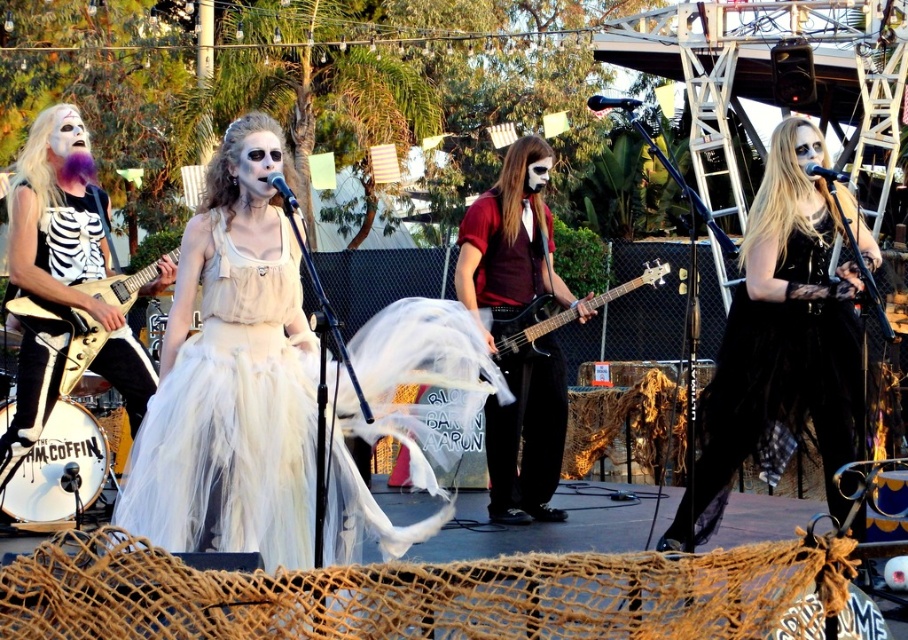
You are a photographer at the music festival. You want to capture a closeup shot of the singer in the white tulle dress at center. The stage is divided into sections with coordinates. The center of the stage is at point 0.5, 0.5. Your camera is currently focused on point (x=232, y=419). Is your camera already focused on the singer?

The white tulle dress at center is located at point (x=232, y=419), so yes, the camera is already focused on the singer in the white tulle dress at center.

You are a photographer at the concert. You want to take a photo that includes both the matte white dress at center and the black velvet dress at right. Which dress will appear larger in the photo?

The matte white dress at center will appear larger in the photo because it is closer to the viewer than the black velvet dress at right.

You are standing in the audience watching the performance. You notice two points marked on the stage. The first point is at coordinates point (215, 392) and the second is at point (566, 310). Which point is closer to you?

Point (215, 392) is closer to the viewer than point (566, 310).